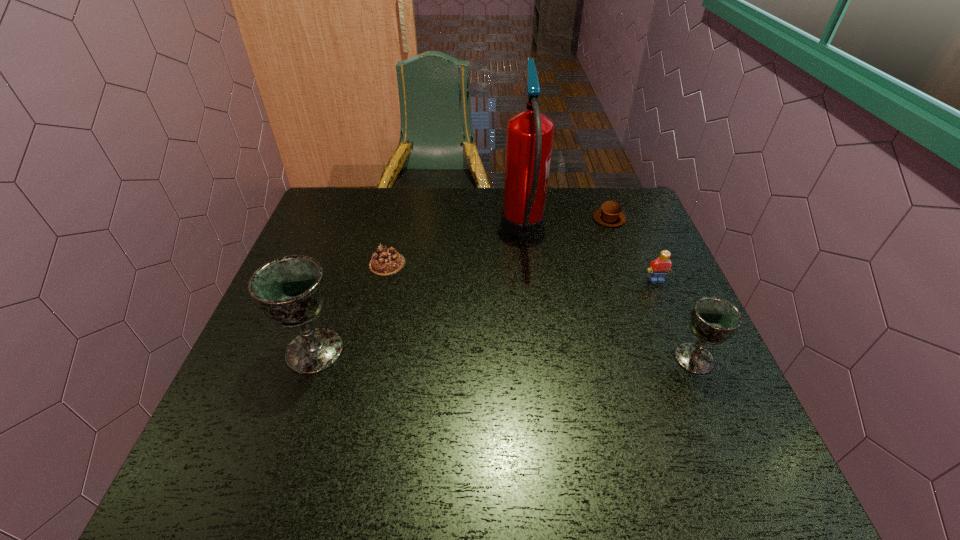
This screenshot has width=960, height=540. In order to click on the left chalice in this screenshot , I will do `click(291, 290)`.

The width and height of the screenshot is (960, 540). I want to click on the taller chalice, so click(x=291, y=290).

I want to click on the fourth shortest object, so click(x=713, y=320).

Find the location of `the shorter chalice`. the shorter chalice is located at coordinates (713, 320).

This screenshot has height=540, width=960. What are the coordinates of `fire extinguisher` in the screenshot? It's located at (529, 138).

At what (x,y) coordinates should I click in order to perform the action: click on the tallest object. Please return your answer as a coordinate pair (x, y). The height and width of the screenshot is (540, 960). Looking at the image, I should click on (529, 138).

This screenshot has width=960, height=540. Identify the location of muffin. (609, 214).

Identify the location of the shortest object. (385, 261).

At what (x,y) coordinates should I click in order to perform the action: click on Lego. Please return your answer as a coordinate pair (x, y). Looking at the image, I should click on (660, 267).

Locate an element on the screen. The image size is (960, 540). the third shortest object is located at coordinates (660, 267).